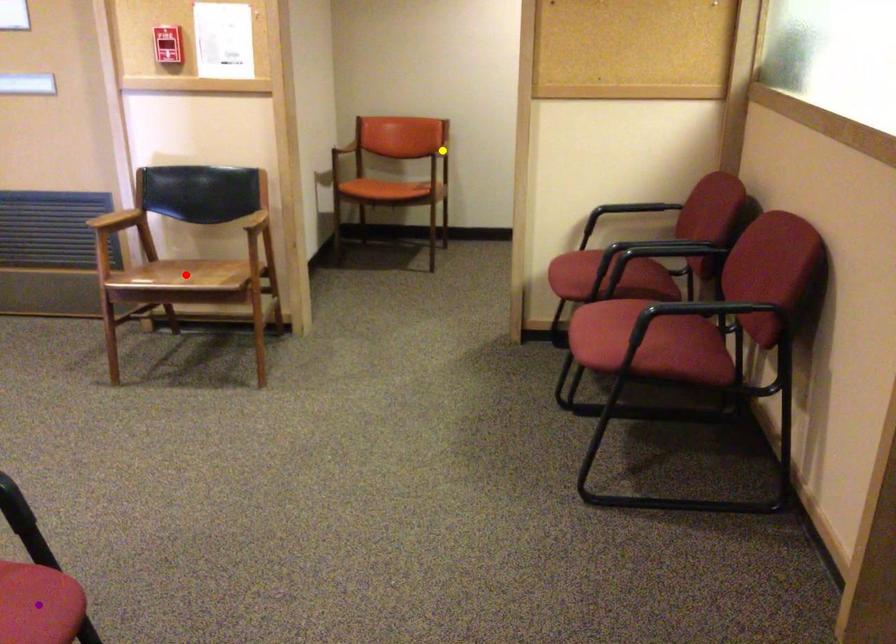
Order these from nearest to farthest:
yellow point | red point | purple point

purple point < red point < yellow point